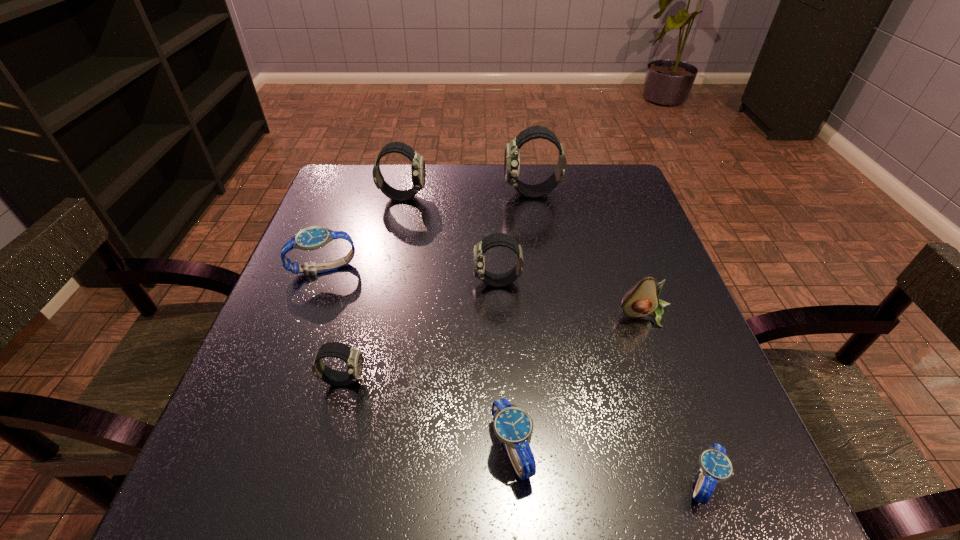
Find the location of a particular element. This screenshot has width=960, height=540. free point that satisfies the following two spatial constraints: 1. on the face of the biggest dark watch; 2. on the right side of the shortest watch is located at coordinates (576, 481).